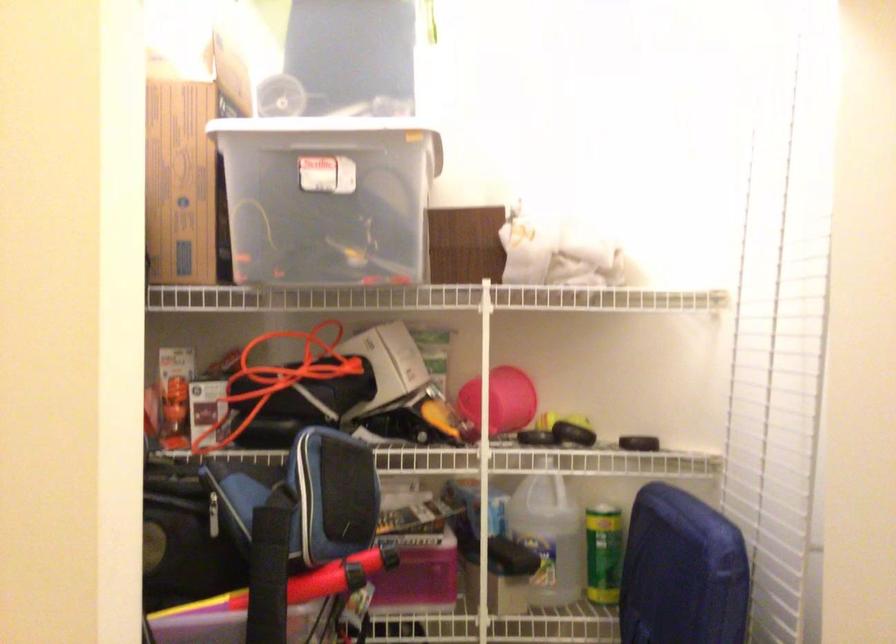
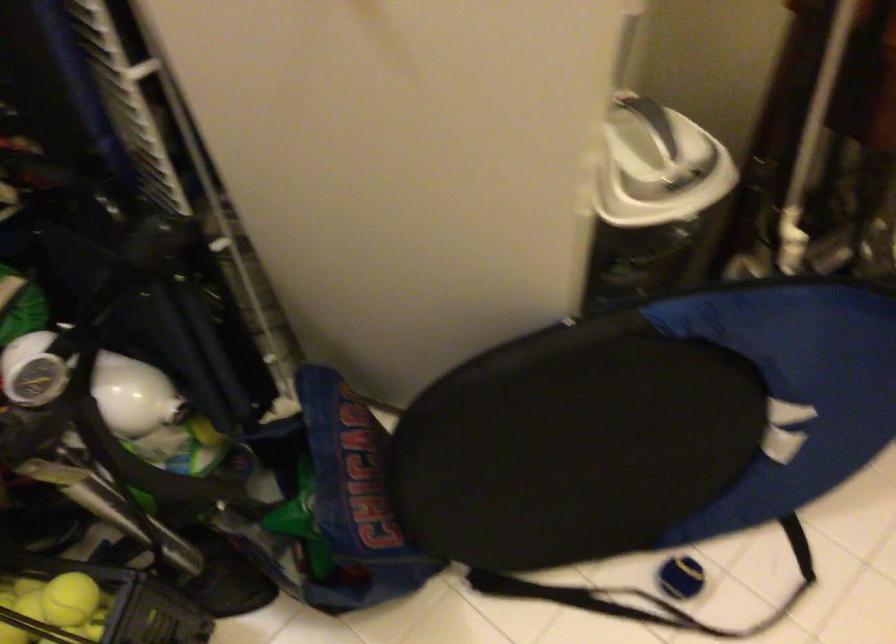
Based on the continuous images, in which direction is the camera rotating?

The rotation direction of the camera is right-down.